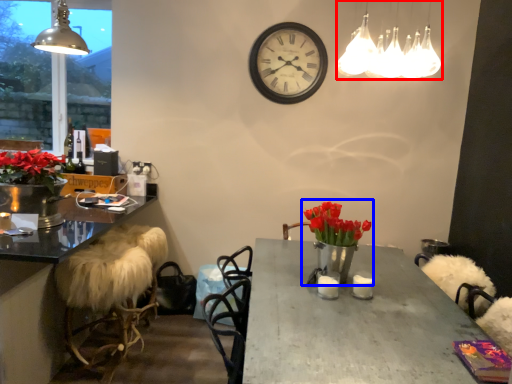
Question: Which point is further to the camera, lamp (highlighted by a red box) or floral arrangement (highlighted by a blue box)?

Choices:
 (A) lamp
 (B) floral arrangement

Answer: (B)